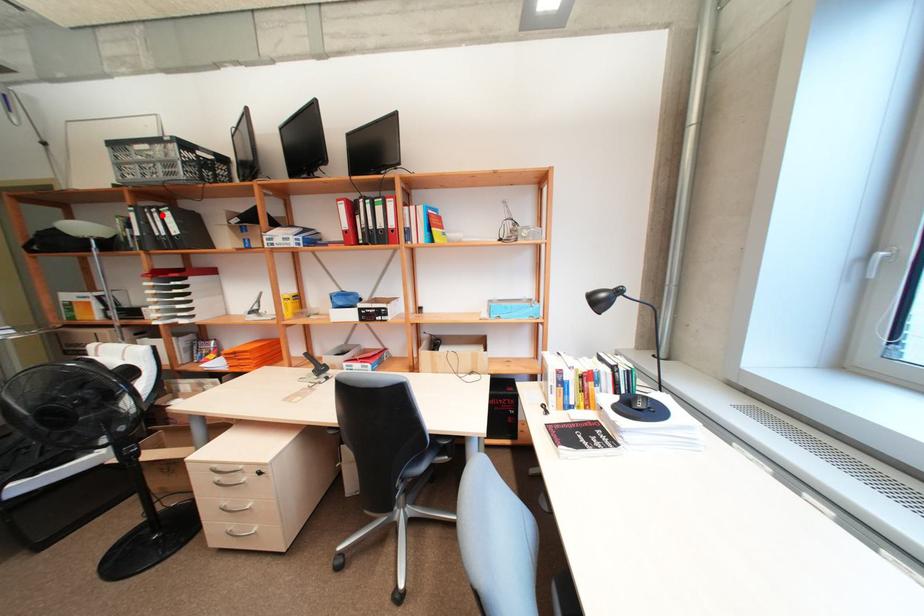
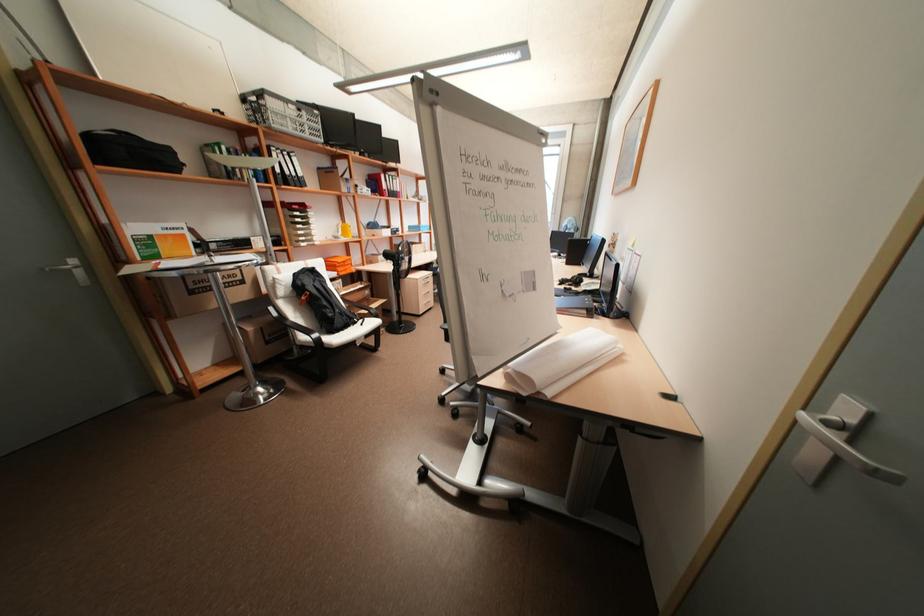
Question: I am providing you with two images of the same scene from different viewpoints. Image1 has a red point marked. In image2, the corresponding 3D location appears at what relative position? Reply with the corresponding letter.

Choices:
 (A) Closer
 (B) Farther

Answer: (A)